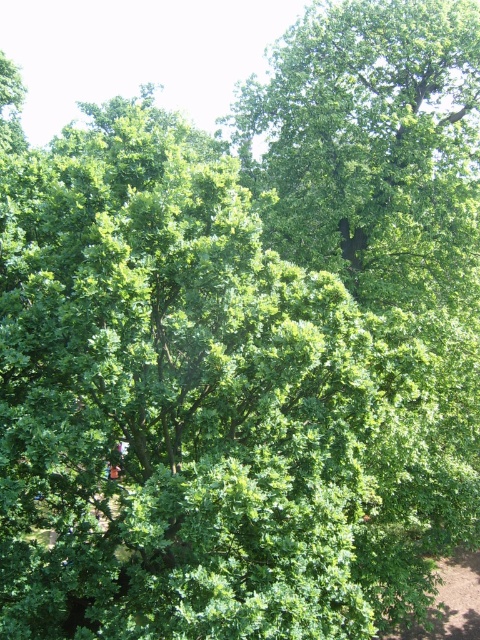
Is green leafy tree at upper center to the left of brown dirt path at lower right from the viewer's perspective?

Incorrect, green leafy tree at upper center is not on the left side of brown dirt path at lower right.

Is green leafy tree at upper center above brown dirt path at lower right?

Yes, green leafy tree at upper center is above brown dirt path at lower right.

Image resolution: width=480 pixels, height=640 pixels. Describe the element at coordinates (372, 145) in the screenshot. I see `green leafy tree at upper center` at that location.

Identify the location of green leafy tree at upper center. This screenshot has width=480, height=640. (372, 145).